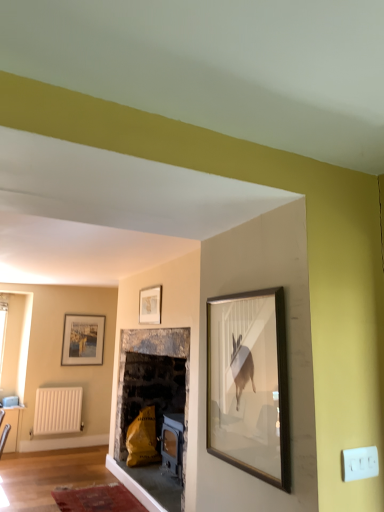
Question: From their relative heights in the image, would you say matte white picture frame at left, the second picture frame from the top, is taller or shorter than white matte radiator at lower left?

Choices:
 (A) tall
 (B) short

Answer: (A)

Question: From a real-world perspective, is matte white picture frame at left, which is counted as the 1th picture frame, starting from the bottom, positioned above or below white matte radiator at lower left?

Choices:
 (A) above
 (B) below

Answer: (A)

Question: Considering the real-world distances, which object is farthest from the white matte radiator at lower left?

Choices:
 (A) wooden picture frame at upper center, the first picture frame from the front
 (B) matte white picture frame at left, which is counted as the 1th picture frame, starting from the bottom

Answer: (A)

Question: Which is farther from the matte white picture frame at left, acting as the 1th picture frame starting from the left?

Choices:
 (A) wooden picture frame at upper center, arranged as the second picture frame when ordered from the bottom
 (B) white matte radiator at lower left

Answer: (A)